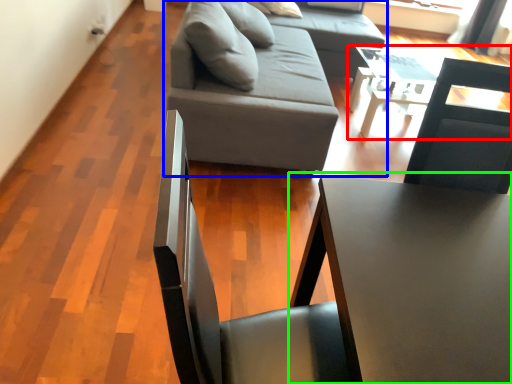
Question: Considering the real-world distances, which object is closest to table (highlighted by a red box)? studio couch (highlighted by a blue box) or table (highlighted by a green box).

Choices:
 (A) studio couch
 (B) table

Answer: (A)